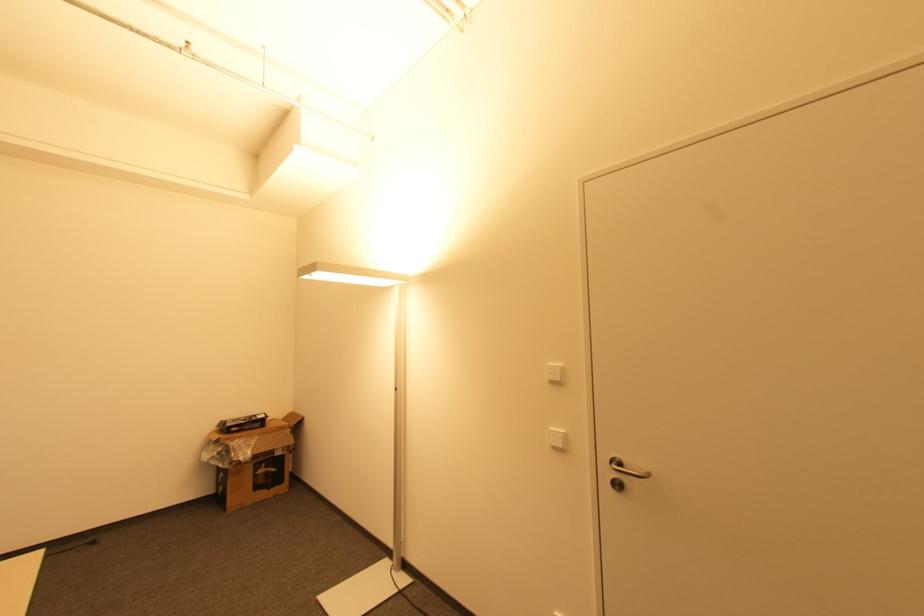
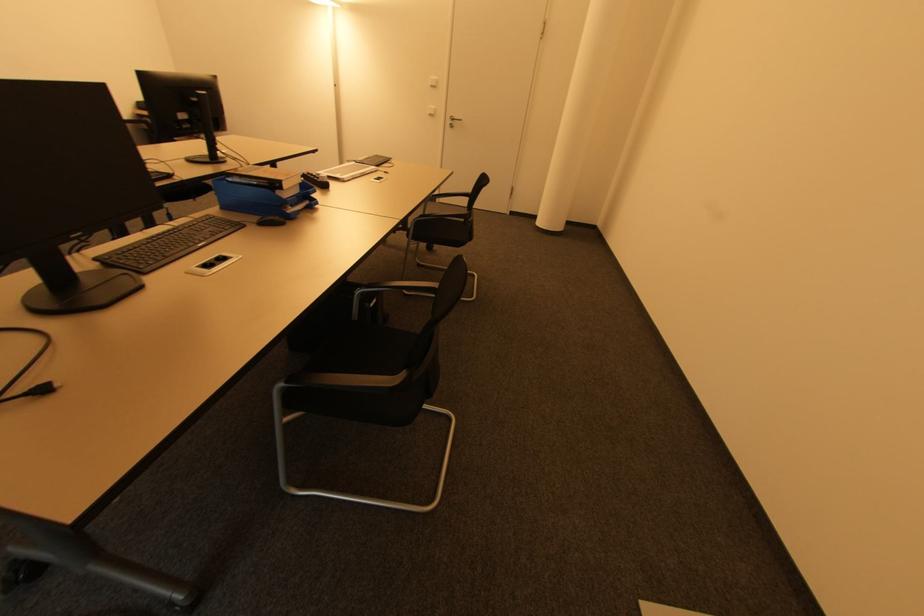
Where in the second image is the point corresponding to pixel 554 383 from the first image?

(434, 87)